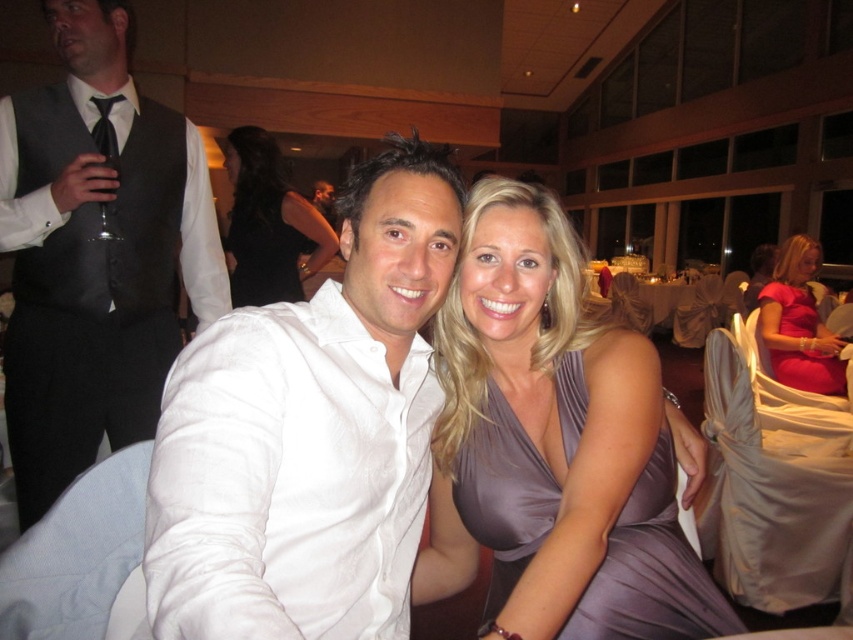
Does white cotton shirt at center lie behind black satin dress at center?

No, it is in front of black satin dress at center.

Is white cotton shirt at center positioned in front of black satin dress at center?

That is True.

Is point (354, 577) more distant than point (247, 209)?

No, (354, 577) is in front of (247, 209).

Locate an element on the screen. white cotton shirt at center is located at coordinates (309, 433).

Looking at this image, can you confirm if white cotton shirt at center is shorter than matte black vest at left?

Yes.

Who is more forward, (392, 305) or (73, 35)?

Point (392, 305)

This screenshot has width=853, height=640. I want to click on white cotton shirt at center, so click(x=309, y=433).

Is point (120, 445) behind point (840, 381)?

No, it is not.

Who is more distant from viewer, (129, 32) or (770, 285)?

The point (129, 32) is more distant.

Identify the location of matte black vest at left. (96, 252).